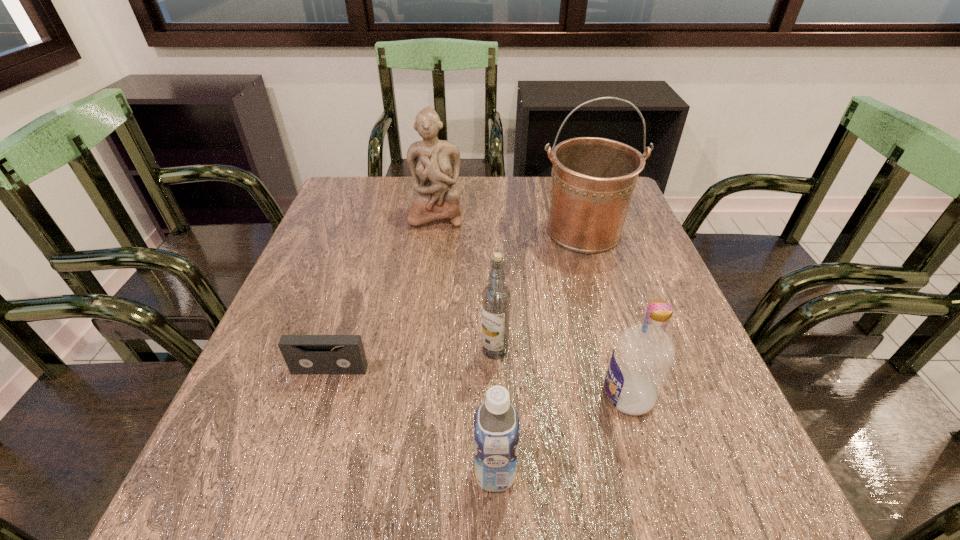
Where is `vacant space at the left edge`? This screenshot has width=960, height=540. vacant space at the left edge is located at coordinates (339, 237).

Identify the location of free region at the right edge of the desktop. (636, 300).

You are a GUI agent. You are given a task and a screenshot of the screen. Output one action in this format:
    pyautogui.click(x=<x>, y=<y>)
    Task: Click on the vacant position at the far left corner of the desktop
    The image size is (960, 540).
    Given the screenshot: What is the action you would take?
    pyautogui.click(x=351, y=218)

At what (x,y) coordinates should I click in order to perform the action: click on vacant space at the near left corner. Please return your answer as a coordinate pair (x, y). Looking at the image, I should click on (266, 472).

Identify the location of free space between the third farthest object and the fifth object from right to left. (466, 282).

Locate an element on the screen. vacant area between the bucket and the leftmost object is located at coordinates (457, 301).

Where is `vacant space that's between the third farthest object and the third nearest object`? vacant space that's between the third farthest object and the third nearest object is located at coordinates (413, 360).

Locate an element on the screen. This screenshot has width=960, height=540. free space between the leftmost object and the tallest object is located at coordinates (457, 301).

Identify the location of vacant area that lies between the farther vodka and the second nearest object. click(562, 373).

Image resolution: width=960 pixels, height=540 pixels. I want to click on vacant area that lies between the bucket and the fourth nearest object, so click(540, 291).